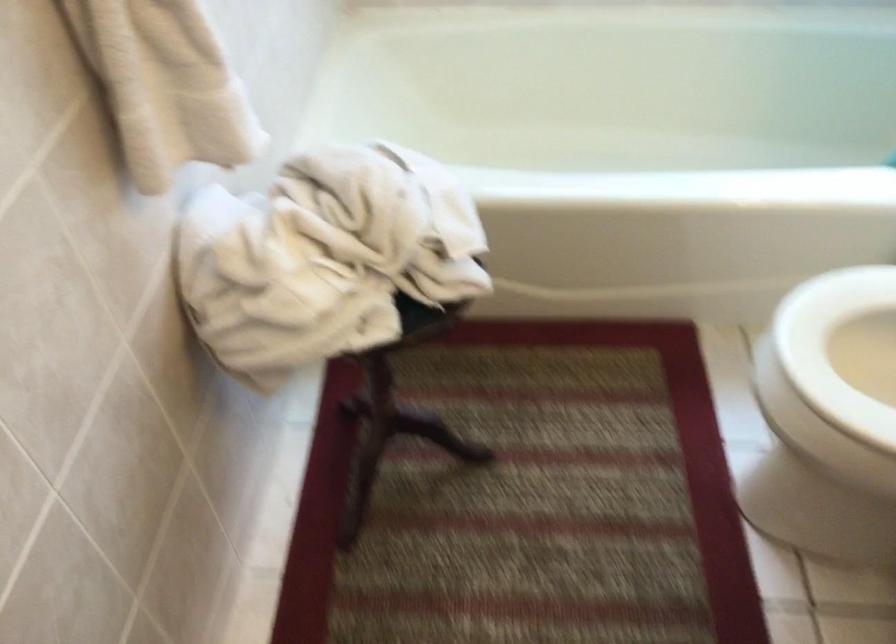
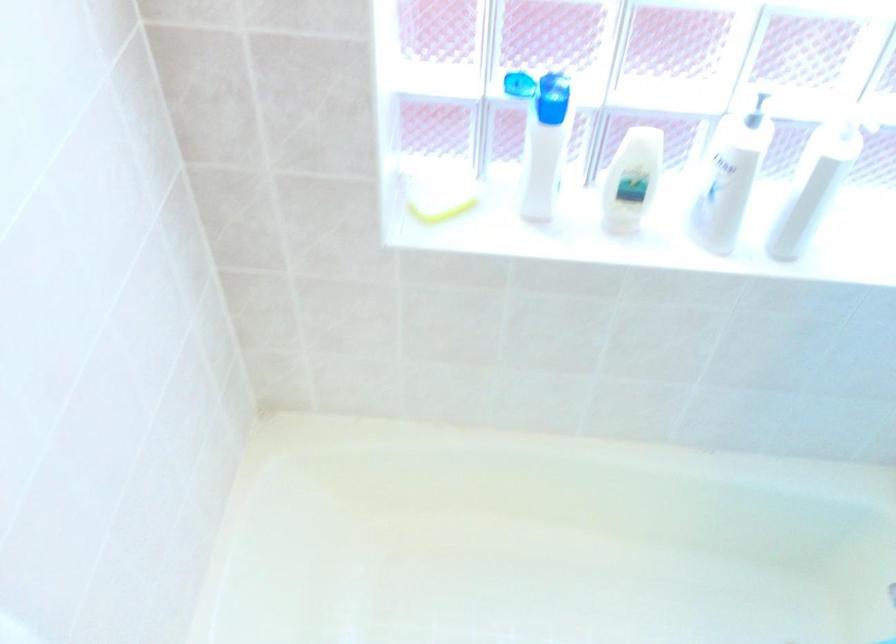
Which direction would the cameraman need to move to produce the second image?

The cameraman moved toward right, forward.